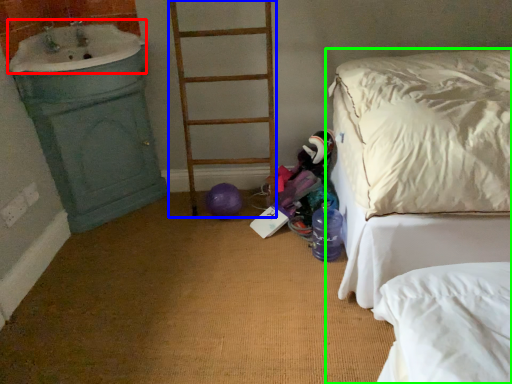
Question: Which object is the farthest from sink (highlighted by a red box)? Choose among these: ladder (highlighted by a blue box) or bed (highlighted by a green box).

Choices:
 (A) ladder
 (B) bed

Answer: (B)